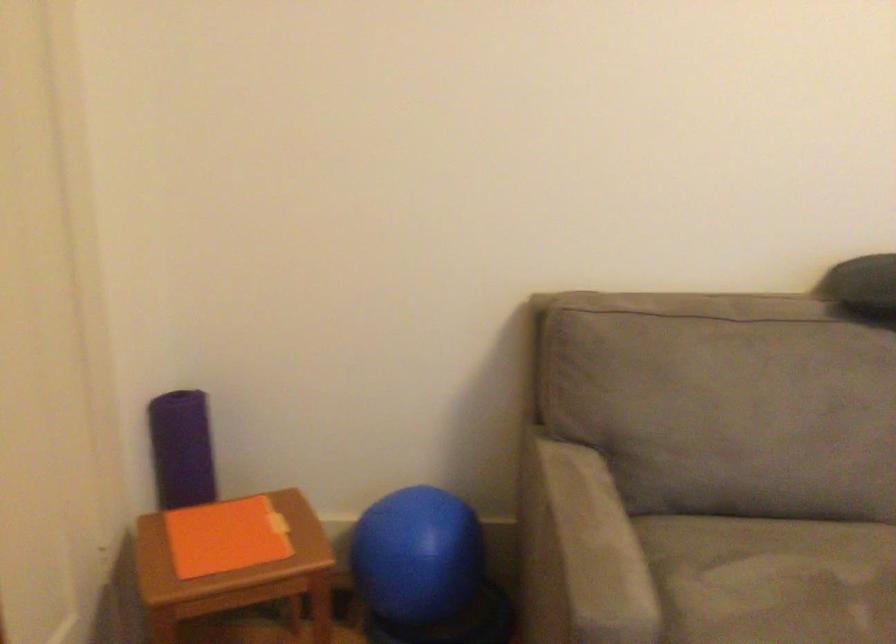
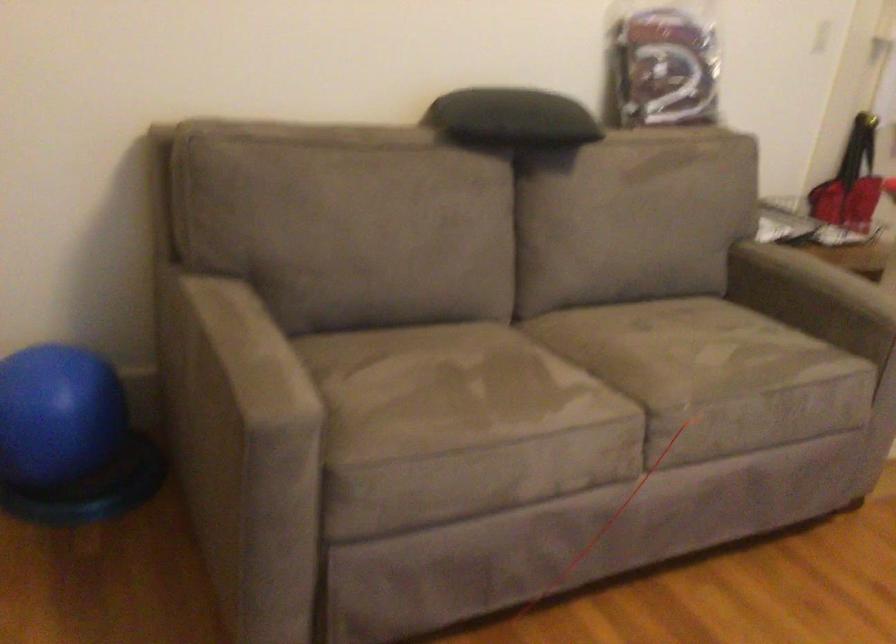
Question: The camera is either moving clockwise (left) or counter-clockwise (right) around the object. The first image is from the beginning of the video and the second image is from the end. Is the camera moving left or right when shooting the video?

Choices:
 (A) Left
 (B) Right

Answer: (A)